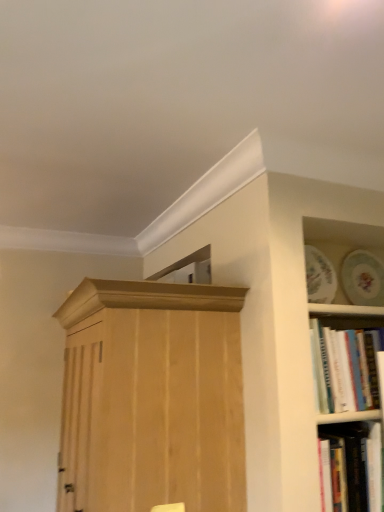
Question: Is natural wood cupboard at center at the back of hardcover book at lower right, which is the 2th book in top-to-bottom order?

Choices:
 (A) yes
 (B) no

Answer: (B)

Question: Does hardcover book at lower right, which is the 2th book in top-to-bottom order, appear on the right side of natural wood cupboard at center?

Choices:
 (A) yes
 (B) no

Answer: (A)

Question: Is hardcover book at lower right, which is the 2th book in top-to-bottom order, facing towards natural wood cupboard at center?

Choices:
 (A) no
 (B) yes

Answer: (A)

Question: From a real-world perspective, is hardcover book at lower right, which is the 2th book in top-to-bottom order, physically above natural wood cupboard at center?

Choices:
 (A) no
 (B) yes

Answer: (A)

Question: From the image's perspective, would you say hardcover book at lower right, which is the 2th book in top-to-bottom order, is shown under natural wood cupboard at center?

Choices:
 (A) yes
 (B) no

Answer: (A)

Question: Is the surface of hardcover book at lower right, which is the 2th book in top-to-bottom order, in direct contact with natural wood cupboard at center?

Choices:
 (A) yes
 (B) no

Answer: (B)

Question: From a real-world perspective, is natural wood cupboard at center on hardcover book at lower right, marked as the first book in a bottom-to-top arrangement?

Choices:
 (A) no
 (B) yes

Answer: (B)

Question: Is natural wood cupboard at center far from hardcover book at lower right, marked as the first book in a bottom-to-top arrangement?

Choices:
 (A) no
 (B) yes

Answer: (A)

Question: From the image's perspective, is natural wood cupboard at center over hardcover book at lower right, which is the 2th book in top-to-bottom order?

Choices:
 (A) yes
 (B) no

Answer: (A)

Question: Is natural wood cupboard at center positioned in front of hardcover book at lower right, which is the 2th book in top-to-bottom order?

Choices:
 (A) no
 (B) yes

Answer: (B)

Question: Is natural wood cupboard at center further to camera compared to hardcover book at lower right, marked as the first book in a bottom-to-top arrangement?

Choices:
 (A) no
 (B) yes

Answer: (A)

Question: Can you confirm if natural wood cupboard at center is bigger than hardcover book at lower right, which is the 2th book in top-to-bottom order?

Choices:
 (A) yes
 (B) no

Answer: (A)

Question: From the image's perspective, is hardcover book at lower right, marked as the first book in a bottom-to-top arrangement, located above white paperbacks at right, placed as the first book when sorted from top to bottom?

Choices:
 (A) yes
 (B) no

Answer: (B)